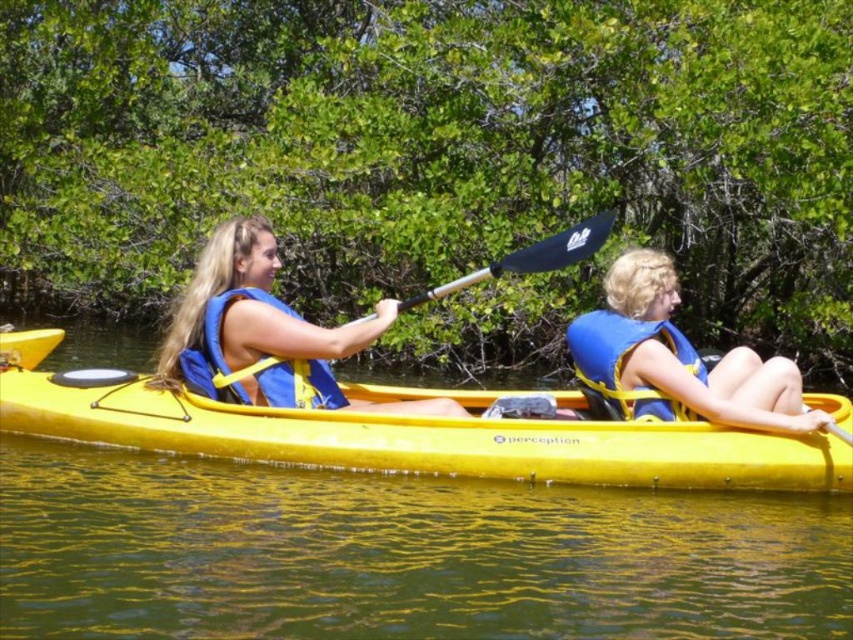
Can you confirm if yellow plastic canoe at center is positioned to the right of blue life vest at center?

Yes, yellow plastic canoe at center is to the right of blue life vest at center.

The width and height of the screenshot is (853, 640). What do you see at coordinates (416, 438) in the screenshot?
I see `yellow plastic canoe at center` at bounding box center [416, 438].

Is point (236, 417) positioned after point (416, 410)?

No, (236, 417) is closer to viewer.

Identify the location of yellow plastic canoe at center. (416, 438).

Looking at this image, who is taller, blue life vest at center or blue fabric life jacket at right?

blue fabric life jacket at right is taller.

Does point (189, 305) come farther from viewer compared to point (648, 321)?

Yes, point (189, 305) is farther from viewer.

Between point (221, 342) and point (606, 374), which one is positioned in front?

Point (221, 342)

Where is `blue life vest at center`? Image resolution: width=853 pixels, height=640 pixels. blue life vest at center is located at coordinates (263, 333).

Can you confirm if blue fabric life jacket at left is bigger than black plastic paddle at center?

No, blue fabric life jacket at left is not bigger than black plastic paddle at center.

Can you confirm if blue fabric life jacket at left is smaller than black plastic paddle at center?

Indeed, blue fabric life jacket at left has a smaller size compared to black plastic paddle at center.

In order to click on blue fabric life jacket at left in this screenshot , I will do `click(254, 364)`.